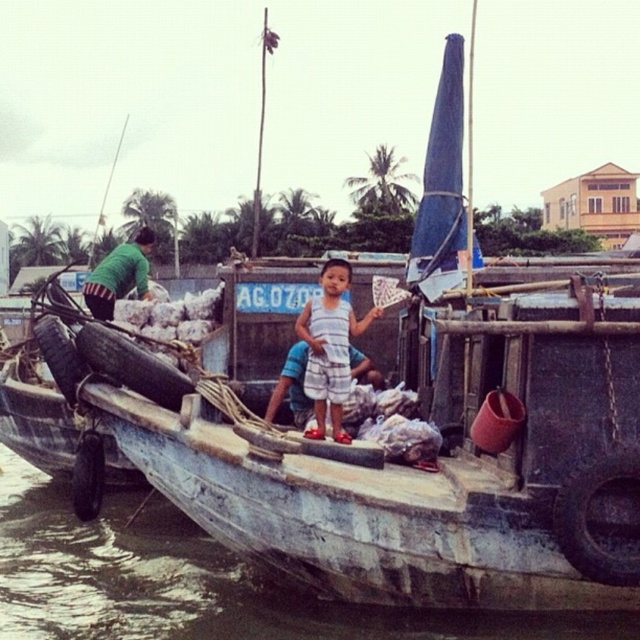
Question: Which object is positioned closest to the smooth concrete boat at center?

Choices:
 (A) striped shorts at center
 (B) green fabric shirt at left

Answer: (A)

Question: Is smooth concrete boat at center thinner than striped shorts at center?

Choices:
 (A) no
 (B) yes

Answer: (A)

Question: Which point appears closest to the camera in this image?

Choices:
 (A) (376, 312)
 (B) (104, 260)
 (C) (339, 628)

Answer: (C)

Question: Can you confirm if smooth concrete boat at center is bigger than striped shorts at center?

Choices:
 (A) no
 (B) yes

Answer: (B)

Question: Which object appears closest to the camera in this image?

Choices:
 (A) green fabric shirt at left
 (B) smooth concrete boat at center

Answer: (B)

Question: Can you confirm if striped shorts at center is thinner than green fabric shirt at left?

Choices:
 (A) no
 (B) yes

Answer: (B)